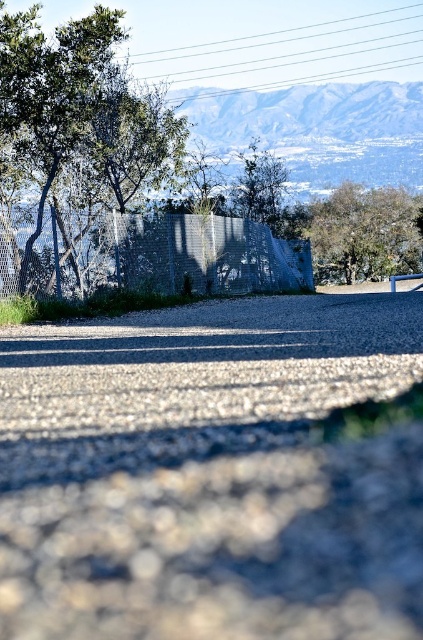
Question: Is gray gravel at center closer to the viewer compared to green leafy tree at upper right?

Choices:
 (A) no
 (B) yes

Answer: (B)

Question: Can you confirm if gray gravel at center is wider than green leafy tree at left?

Choices:
 (A) no
 (B) yes

Answer: (B)

Question: In this image, where is green leafy tree at left located relative to green leafy tree at upper right?

Choices:
 (A) right
 (B) left

Answer: (B)

Question: Which of these objects is positioned closest to the green leafy tree at upper right?

Choices:
 (A) gray gravel at center
 (B) green leafy tree at left

Answer: (B)

Question: Which of the following is the closest to the observer?

Choices:
 (A) green leafy tree at left
 (B) green leafy tree at upper right

Answer: (A)

Question: Which object is closer to the camera taking this photo?

Choices:
 (A) green leafy tree at left
 (B) green leafy tree at upper right
 (C) gray gravel at center

Answer: (C)